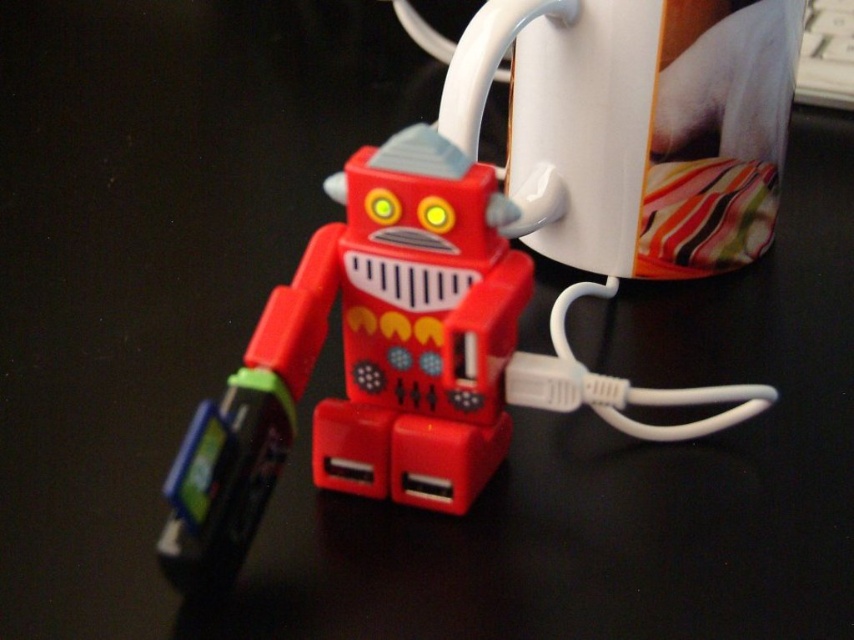
You are setting up your desk and want to place the rubberized plastic robot at center and the white glossy mug at upper center. According to the scene, which object is closer to you?

The rubberized plastic robot at center is positioned under the white glossy mug at upper center, so the white glossy mug at upper center is closer to you.

You are organizing your desk and want to place the rubberized plastic robot at center and the white glossy mug at upper center. Based on their current positions, which object is closer to the left edge of the desk?

→ The rubberized plastic robot at center is closer to the left edge of the desk because it is positioned to the left of the white glossy mug at upper center.

You are organizing cables on your desk and need to place the rubberized plastic robot at center and the white glossy mug at upper center. Based on their positions, which object is closer to you?

The rubberized plastic robot at center is closer to you because it is in front of the white glossy mug at upper center.